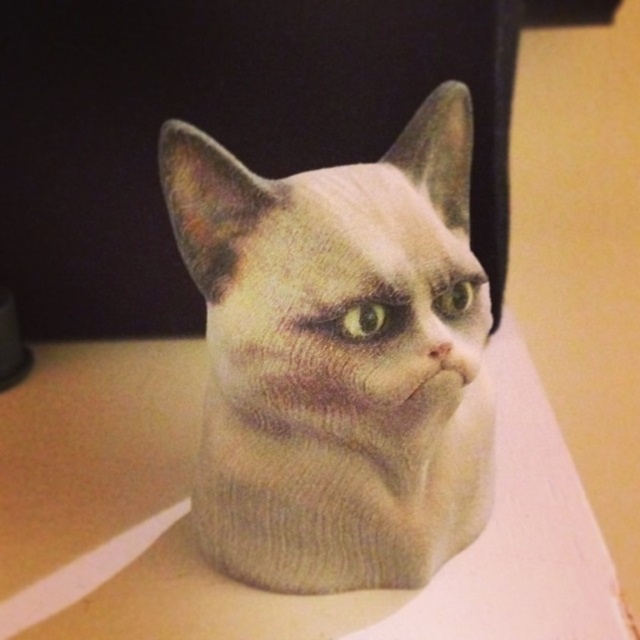
Question: Is fuzzy beige cat at center in front of white matte table at center?

Choices:
 (A) no
 (B) yes

Answer: (B)

Question: Does fuzzy beige cat at center have a larger size compared to white matte table at center?

Choices:
 (A) yes
 (B) no

Answer: (A)

Question: Is fuzzy beige cat at center smaller than white matte table at center?

Choices:
 (A) yes
 (B) no

Answer: (B)

Question: Which point appears closest to the camera in this image?

Choices:
 (A) (246, 272)
 (B) (52, 548)

Answer: (A)